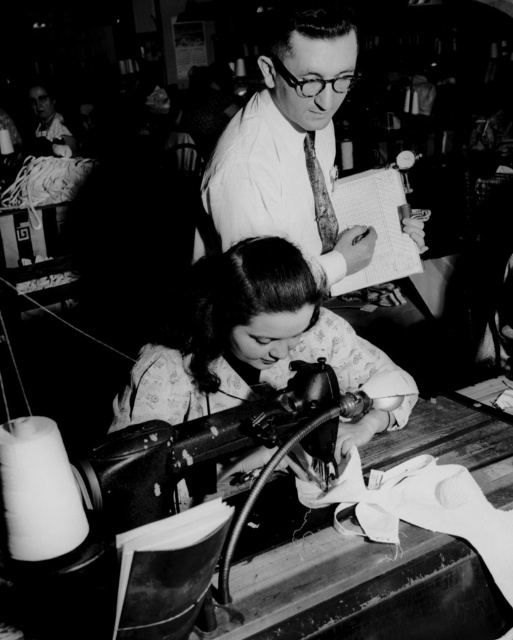
Which is more to the left, metallic sewing machine at lower center or smooth skin face at upper left?

smooth skin face at upper left

Between metallic sewing machine at lower center and smooth skin face at upper left, which one appears on the right side from the viewer's perspective?

From the viewer's perspective, metallic sewing machine at lower center appears more on the right side.

Between point (309, 436) and point (34, 109), which one is positioned behind?

Point (34, 109)

The image size is (513, 640). In order to click on metallic sewing machine at lower center in this screenshot , I will do `click(212, 444)`.

In the scene shown: Who is shorter, matte fabric blouse at center or smooth skin face at upper left?

With less height is matte fabric blouse at center.

Between matte fabric blouse at center and smooth skin face at upper left, which one appears on the left side from the viewer's perspective?

smooth skin face at upper left is more to the left.

Locate an element on the screen. The width and height of the screenshot is (513, 640). matte fabric blouse at center is located at coordinates (254, 342).

Where is `smooth white shirt at upper center`? smooth white shirt at upper center is located at coordinates (290, 145).

Is the position of smooth white shirt at upper center more distant than that of metallic sewing machine at lower center?

Yes, it is behind metallic sewing machine at lower center.

Which is behind, point (258, 65) or point (110, 500)?

The point (258, 65) is more distant.

I want to click on smooth white shirt at upper center, so click(x=290, y=145).